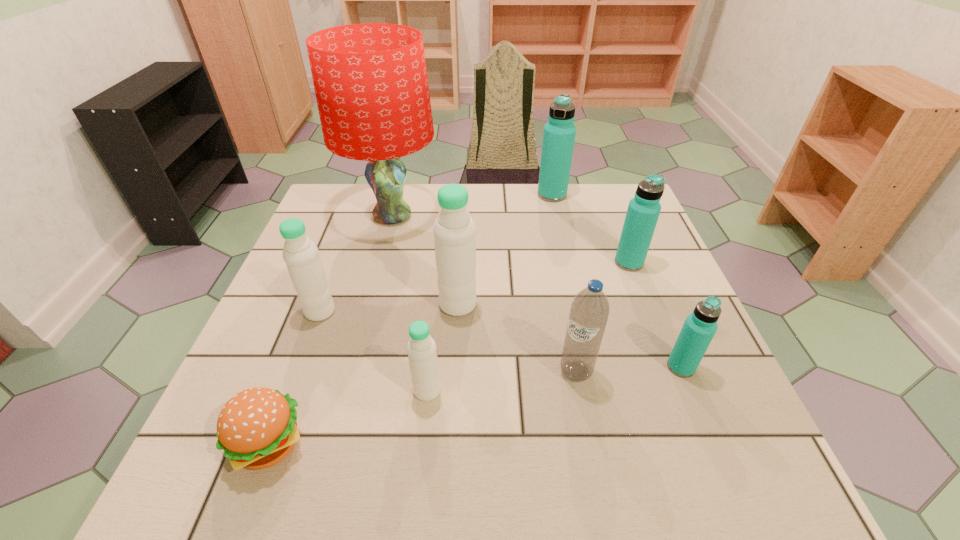
This screenshot has width=960, height=540. In the image, there is a desktop. In order to click on free space at the left edge in this screenshot , I will do pyautogui.click(x=289, y=331).

The image size is (960, 540). What are the coordinates of `vacant area at the right edge` in the screenshot? It's located at (725, 390).

This screenshot has width=960, height=540. Find the location of `vacant region at the far right corner of the desktop`. vacant region at the far right corner of the desktop is located at coordinates (610, 187).

Image resolution: width=960 pixels, height=540 pixels. In the image, there is a desktop. Identify the location of free space at the near right corner. (758, 479).

At what (x,y) coordinates should I click in order to perform the action: click on vacant area that lies between the farthest blue water bottle and the hamburger. Please return your answer as a coordinate pair (x, y). Looking at the image, I should click on pos(411,320).

What are the coordinates of `vacant area between the lampshade and the biggest blue water bottle` in the screenshot? It's located at (472, 205).

I want to click on free space between the biggest white water bottle and the smallest white water bottle, so click(x=443, y=347).

Where is `empty space between the biggest white water bottle and the second farthest blue water bottle`? empty space between the biggest white water bottle and the second farthest blue water bottle is located at coordinates (543, 284).

This screenshot has width=960, height=540. What are the coordinates of `empty location between the nearest object and the second farthest water bottle` in the screenshot? It's located at (449, 354).

This screenshot has width=960, height=540. What are the coordinates of `free spot between the smallest white water bottle and the second farthest water bottle` in the screenshot? It's located at (528, 327).